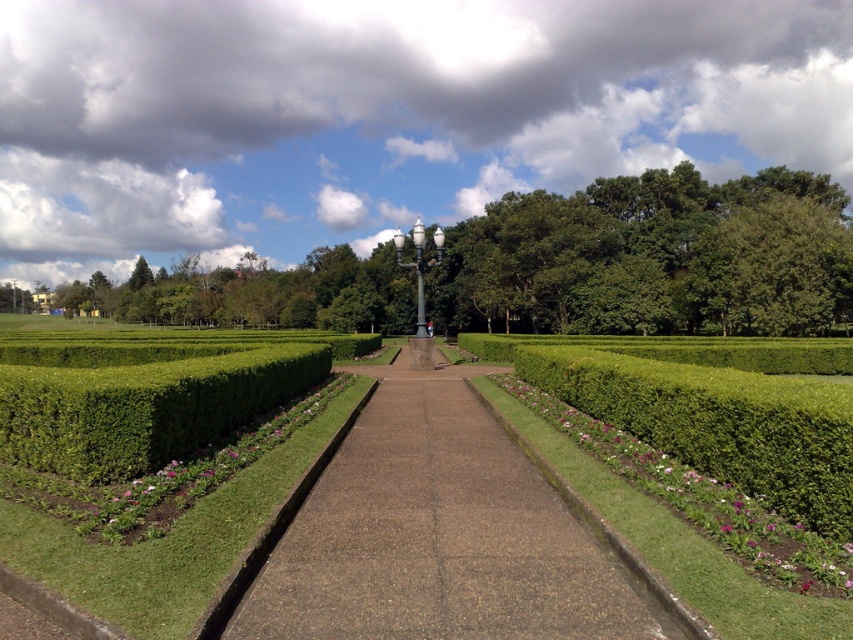
You are standing at the point marked by the coordinate point at center, which is point (142, 406). You want to walk towards the green leafy hedge at left. Which direction should you face to walk directly towards it?

The green leafy hedge at left is represented by point (142, 406), so you should face the direction of the point (142, 406) to walk directly towards the green leafy hedge at left.

You are a gardener planning to water the pink matte flower at lower left and the brown concrete path at center. Since the path is paved, you only need to water the flower. However, you want to ensure you don not accidentally water the path. Based on their positions, which object is higher so you can aim the hose accordingly?

The pink matte flower at lower left is higher than the brown concrete path at center, so you should aim the hose towards the higher position of the pink matte flower at lower left to avoid watering the path.